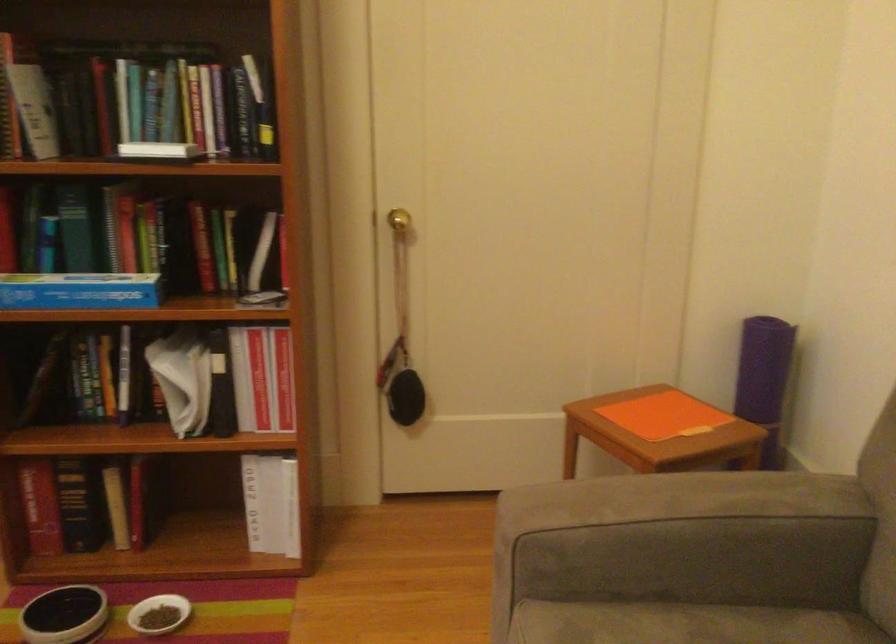
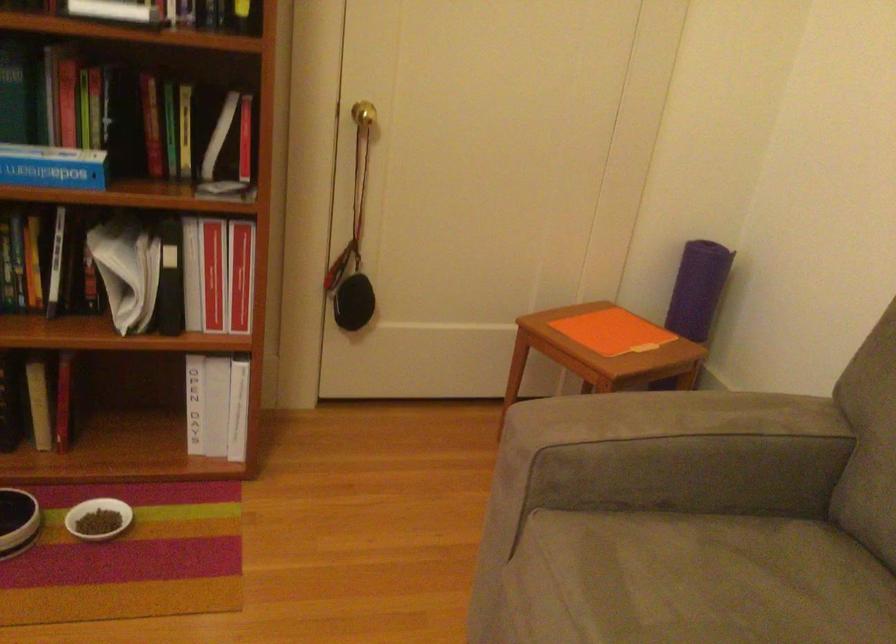
The point at (110, 292) is marked in the first image. Where is the corresponding point in the second image?

(53, 167)